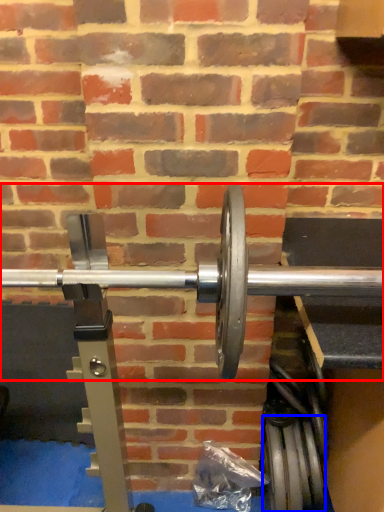
Question: Which object appears closest to the camera in this image, dumbbell (highlighted by a red box) or tire (highlighted by a blue box)?

Choices:
 (A) dumbbell
 (B) tire

Answer: (A)